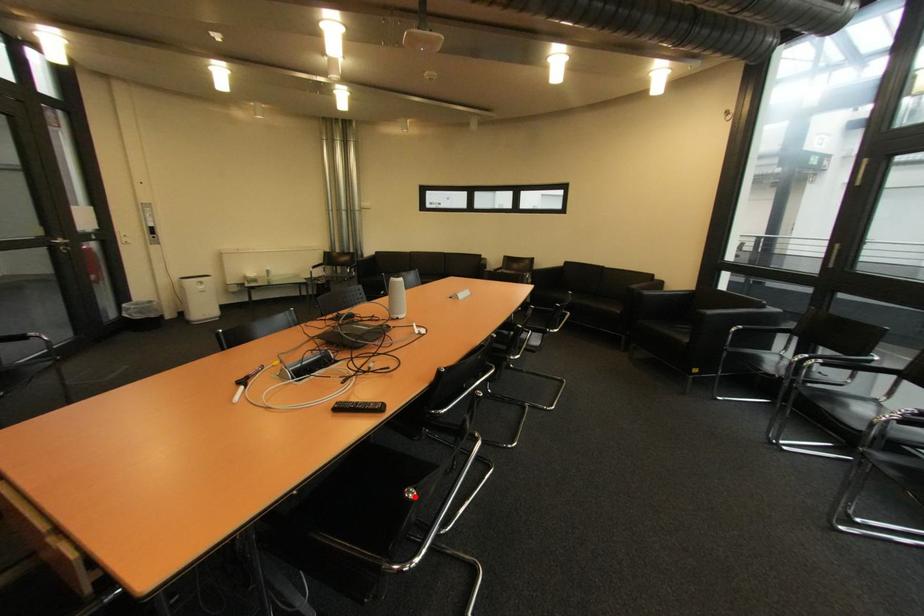
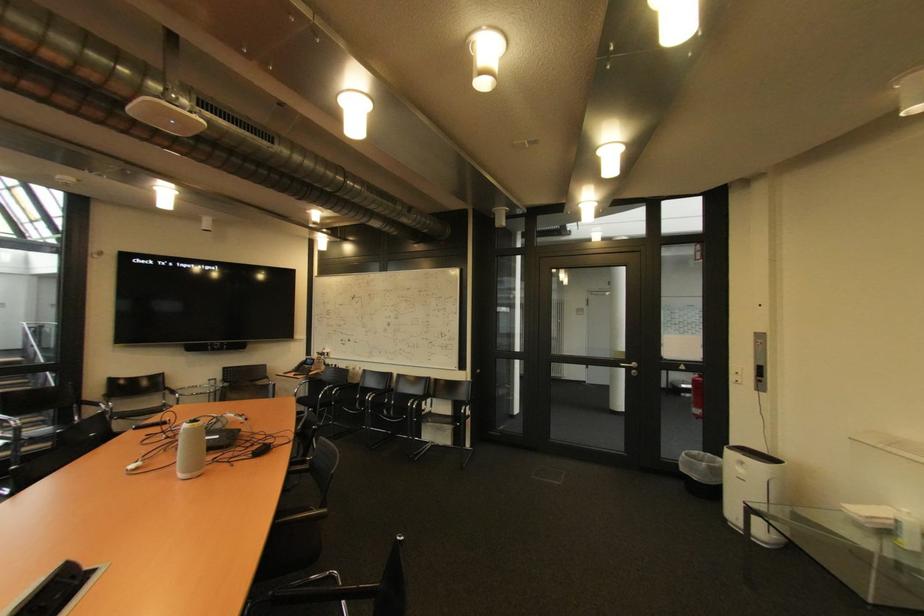
Question: I am providing you with two images of the same scene from different viewpoints. A red point is marked on the first image. Can you still see the location of the red point in image 2?

Choices:
 (A) Yes
 (B) No

Answer: (B)